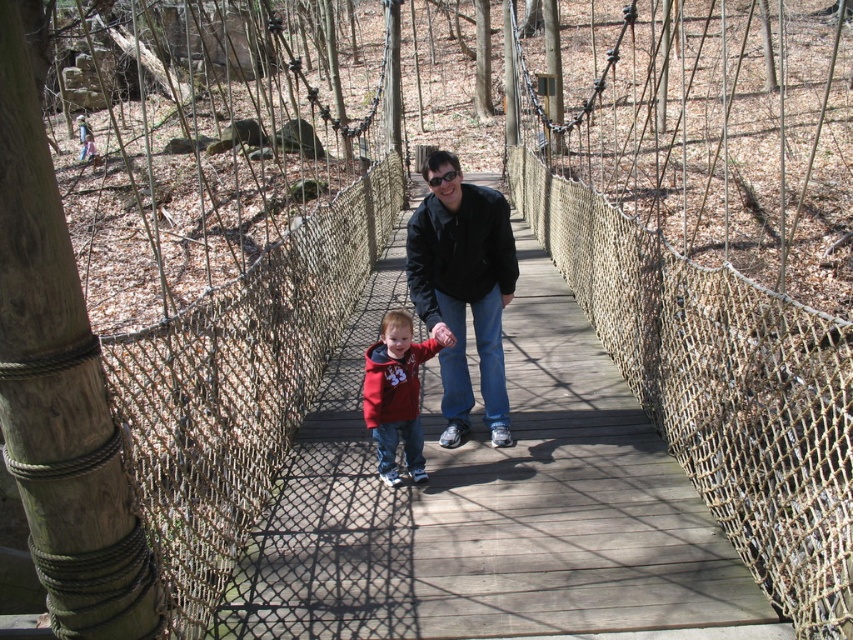
You are a photographer standing on the wooden suspension bridge. You want to take a photo of the two people walking towards you. The camera can focus on objects within a 30 cm range. Will both the matte black jacket at center and the matte red hoodie at center be in focus?

The matte black jacket at center and matte red hoodie at center are 38.23 centimeters apart. Since the camera can only focus on objects within a 30 cm range, the distance between them exceeds the focus range. Therefore, both cannot be in focus simultaneously.

You are standing on the wooden suspension bridge and see the matte black jacket at center. If you want to take a photo of it from where you are standing, will it be in focus if your camera has a depth of field that can sharply capture objects up to 12 feet away?

The matte black jacket at center is 11.87 feet away from the camera. Since the depth of field can capture up to 12 feet, the jacket will be in focus.

You are a drone operator trying to capture a photo of the matte black jacket at center from above. What are the coordinates you should aim for?

The coordinates to aim for are point (x=463, y=289).